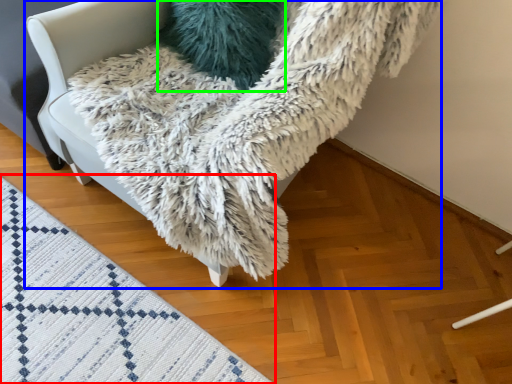
Question: Based on their relative distances, which object is farther from mat (highlighted by a red box)? Choose from furniture (highlighted by a blue box) and pillow (highlighted by a green box).

Choices:
 (A) furniture
 (B) pillow

Answer: (B)